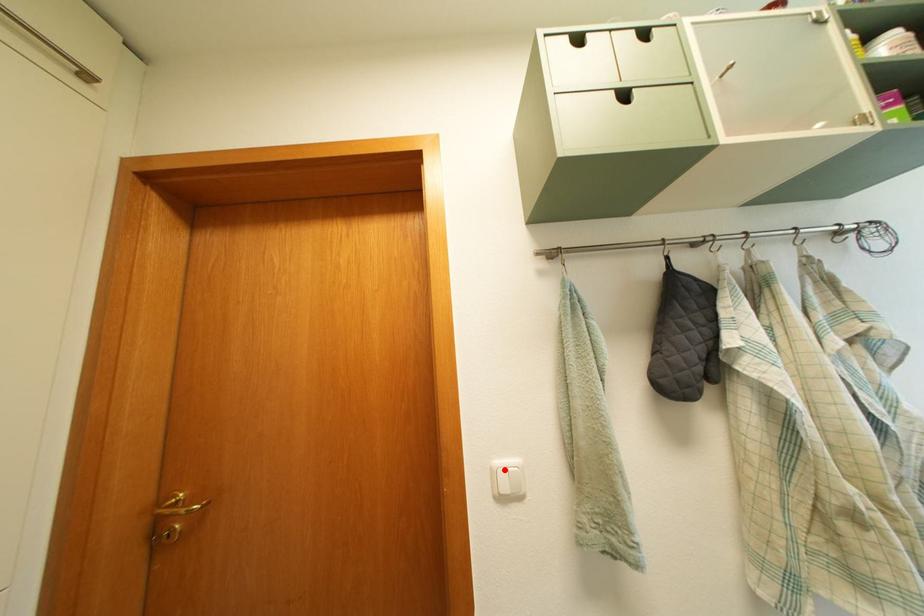
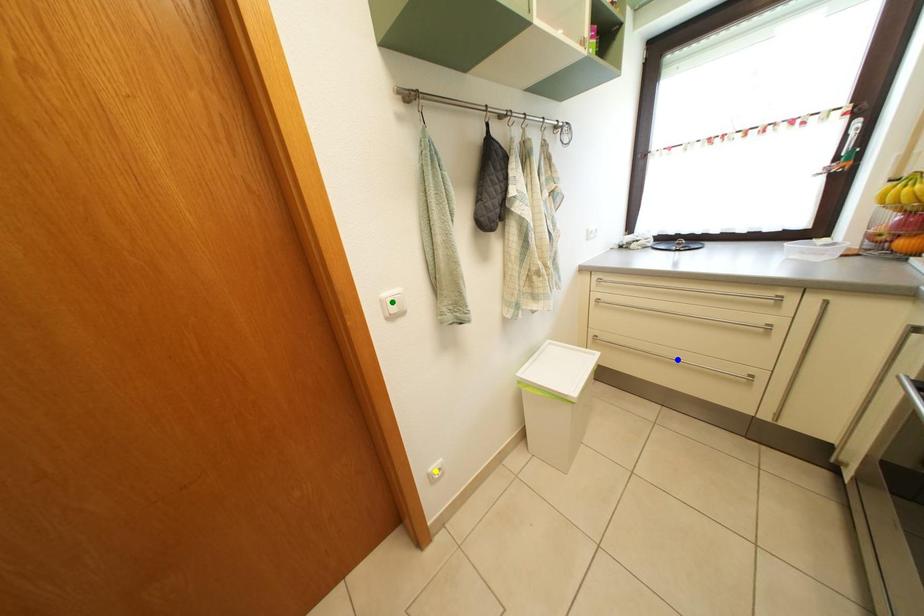
Question: I am providing you with two images of the same scene from different viewpoints. A red point is marked on the first image. You are given multiple points on the second image. Which mark in image 2 goes with the point in image 1?

Choices:
 (A) green point
 (B) yellow point
 (C) blue point

Answer: (A)